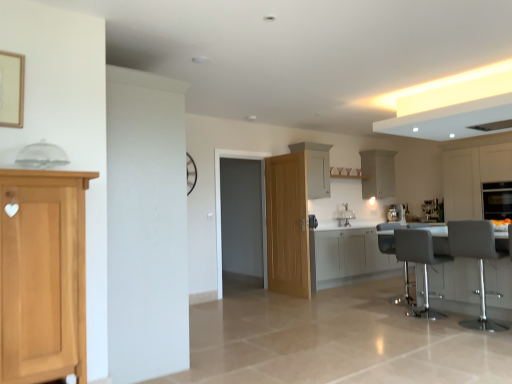
Where is `matte black oven at right`? The width and height of the screenshot is (512, 384). matte black oven at right is located at coordinates (497, 200).

Describe the element at coordinates (497, 200) in the screenshot. Image resolution: width=512 pixels, height=384 pixels. I see `matte black oven at right` at that location.

Where is `light brown wood cabinet at left, the fifth cabinetry when ordered from right to left`? This screenshot has height=384, width=512. light brown wood cabinet at left, the fifth cabinetry when ordered from right to left is located at coordinates point(42,276).

What are the coordinates of `white glossy cabinets at center, the 3th cabinetry from the right` in the screenshot? It's located at (347, 257).

What do you see at coordinates (453, 120) in the screenshot? I see `white glossy exhaust hood at upper right` at bounding box center [453, 120].

What is the approximate width of transparent glass door at center?

transparent glass door at center is 8.96 inches in width.

Locate an element on the screen. matte black oven at right is located at coordinates (497, 200).

Can you confirm if matte black oven at right is positioned to the right of white matte cabinet at right, which is the third cabinetry in back-to-front order?

Yes.

Is matte black oven at right facing away from white matte cabinet at right, which ranks as the 3th cabinetry in front-to-back order?

That's right, matte black oven at right is facing away from white matte cabinet at right, which ranks as the 3th cabinetry in front-to-back order.

From the picture: From a real-world perspective, between matte black oven at right and white matte cabinet at right, which ranks as the 3th cabinetry in front-to-back order, who is vertically higher?

white matte cabinet at right, which ranks as the 3th cabinetry in front-to-back order, is physically above.

What's the angular difference between matte black oven at right and white matte cabinet at right, which ranks as the 3th cabinetry in front-to-back order,'s facing directions?

There is a 1.62-degree angle between the facing directions of matte black oven at right and white matte cabinet at right, which ranks as the 3th cabinetry in front-to-back order.

Considering the sizes of white glossy cabinets at center, the 3th cabinetry from the right, and gray fabric swivel chair at lower right in the image, is white glossy cabinets at center, the 3th cabinetry from the right, bigger or smaller than gray fabric swivel chair at lower right?

Clearly, white glossy cabinets at center, the 3th cabinetry from the right, is larger in size than gray fabric swivel chair at lower right.

Which of these two, white glossy cabinets at center, the 3th cabinetry from the right, or gray fabric swivel chair at lower right, is wider?

Wider between the two is white glossy cabinets at center, the 3th cabinetry from the right.

Considering the sizes of objects white glossy cabinets at center, the 3th cabinetry from the right, and gray fabric swivel chair at lower right in the image provided, who is taller, white glossy cabinets at center, the 3th cabinetry from the right, or gray fabric swivel chair at lower right?

gray fabric swivel chair at lower right.

How different are the orientations of white glossy cabinets at center, which appears as the 3th cabinetry when viewed from the left, and gray fabric swivel chair at lower right in degrees?

white glossy cabinets at center, which appears as the 3th cabinetry when viewed from the left, and gray fabric swivel chair at lower right are facing 1.76 degrees away from each other.

Is white matte cabinet at center, which appears as the fourth cabinetry when viewed from the front, facing away from white leather bar stool at right, arranged as the 2th chair when viewed from the front?

No, white matte cabinet at center, which appears as the fourth cabinetry when viewed from the front,'s orientation is not away from white leather bar stool at right, arranged as the 2th chair when viewed from the front.

Is white matte cabinet at center, which is counted as the 4th cabinetry, starting from the right, in front of or behind white leather bar stool at right, acting as the first chair starting from the back, in the image?

Result: white matte cabinet at center, which is counted as the 4th cabinetry, starting from the right, is positioned farther from the viewer than white leather bar stool at right, acting as the first chair starting from the back.

Is white matte cabinet at center, the 2th cabinetry in the back-to-front sequence, surrounding white leather bar stool at right, arranged as the 2th chair when viewed from the front?

No, white leather bar stool at right, arranged as the 2th chair when viewed from the front, is not inside white matte cabinet at center, the 2th cabinetry in the back-to-front sequence.

Considering the sizes of objects white matte cabinet at center, acting as the second cabinetry starting from the left, and white leather bar stool at right, acting as the first chair starting from the back, in the image provided, who is smaller, white matte cabinet at center, acting as the second cabinetry starting from the left, or white leather bar stool at right, acting as the first chair starting from the back,?

With smaller size is white matte cabinet at center, acting as the second cabinetry starting from the left.

From the image's perspective, is white matte cabinet at right, acting as the 1th cabinetry starting from the right, positioned above or below white glossy sink at center?

white matte cabinet at right, acting as the 1th cabinetry starting from the right, is situated higher than white glossy sink at center in the image.

Could you tell me if white matte cabinet at right, placed as the fifth cabinetry when sorted from left to right, is turned towards white glossy sink at center?

No.

Is white matte cabinet at right, acting as the 1th cabinetry starting from the right, not close to white glossy sink at center?

That's right, there is a large distance between white matte cabinet at right, acting as the 1th cabinetry starting from the right, and white glossy sink at center.

Considering the relative sizes of white matte cabinet at right, acting as the 1th cabinetry starting from the right, and white glossy sink at center in the image provided, is white matte cabinet at right, acting as the 1th cabinetry starting from the right, shorter than white glossy sink at center?

In fact, white matte cabinet at right, acting as the 1th cabinetry starting from the right, may be taller than white glossy sink at center.

Does metallic gray table at lower right turn towards white glossy cabinets at center, the 3th cabinetry from the right?

No, metallic gray table at lower right is not aimed at white glossy cabinets at center, the 3th cabinetry from the right.

How many degrees apart are the facing directions of metallic gray table at lower right and white glossy cabinets at center, which is the 2th cabinetry in front-to-back order?

90.5 degrees separate the facing orientations of metallic gray table at lower right and white glossy cabinets at center, which is the 2th cabinetry in front-to-back order.

Which of these two, metallic gray table at lower right or white glossy cabinets at center, which is the 2th cabinetry in front-to-back order, is smaller?

With smaller size is white glossy cabinets at center, which is the 2th cabinetry in front-to-back order.

Measure the distance from natural wood door at center to matte black oven at right.

natural wood door at center is 3.37 meters away from matte black oven at right.

Is natural wood door at center far from matte black oven at right?

That's right, there is a large distance between natural wood door at center and matte black oven at right.

Does point (300, 177) come closer to viewer compared to point (494, 189)?

Yes, point (300, 177) is closer to viewer.

Where is `door in front of the matte black oven at right`? The image size is (512, 384). door in front of the matte black oven at right is located at coordinates (287, 225).

Considering the sizes of natural wood door at center and gray fabric chair at right, the second chair positioned from the back, in the image, is natural wood door at center bigger or smaller than gray fabric chair at right, the second chair positioned from the back,?

natural wood door at center is smaller than gray fabric chair at right, the second chair positioned from the back.

From a real-world perspective, is natural wood door at center located higher than gray fabric chair at right, the second chair positioned from the back?

Yes, from a real-world perspective, natural wood door at center is over gray fabric chair at right, the second chair positioned from the back

In the scene shown: Is gray fabric chair at right, the second chair positioned from the back, at the back of natural wood door at center?

No, natural wood door at center is not facing the opposite direction of gray fabric chair at right, the second chair positioned from the back.

From the image's perspective, is natural wood door at center located above or below gray fabric chair at right, the second chair positioned from the back?

From the image's perspective, natural wood door at center appears above gray fabric chair at right, the second chair positioned from the back.

Locate an element on the screen. The image size is (512, 384). the 1st cabinetry in front of the matte black oven at right, starting your count from the anchor is located at coordinates (472, 177).

At what (x,y) coordinates should I click in order to perform the action: click on cabinetry located below the gray fabric swivel chair at lower right (from the image's perspective). Please return your answer as a coordinate pair (x, y). The height and width of the screenshot is (384, 512). Looking at the image, I should click on (347, 257).

When comparing their distances from white glossy sink at center, does white matte cabinet at right, which is the third cabinetry in back-to-front order, or white glossy exhaust hood at upper right seem closer?

Based on the image, white glossy exhaust hood at upper right appears to be nearer to white glossy sink at center.

Estimate the real-world distances between objects in this image. Which object is further from white leather bar stool at right, arranged as the 2th chair when viewed from the front, natural wood door at center or white glossy sink at center?

Among the two, white glossy sink at center is located further to white leather bar stool at right, arranged as the 2th chair when viewed from the front.

Estimate the real-world distances between objects in this image. Which object is closer to matte black oven at right, transparent glass door at center or metallic gray table at lower right?

metallic gray table at lower right lies closer to matte black oven at right than the other object.

Based on their spatial positions, is matte black oven at right or satin silver coffee machine at right, positioned as the 2th coffee machine in left-to-right order, further from transparent glass door at center?

satin silver coffee machine at right, positioned as the 2th coffee machine in left-to-right order.

Looking at the image, which one is located further to white matte cabinet at right, acting as the 1th cabinetry starting from the right, transparent glass door at center or white glossy cabinets at center, which is the 2th cabinetry in front-to-back order?

The object further to white matte cabinet at right, acting as the 1th cabinetry starting from the right, is transparent glass door at center.

When comparing their distances from gray fabric swivel chair at lower right, does white matte cabinet at right, which is the third cabinetry in back-to-front order, or white glossy exhaust hood at upper right seem further?

white matte cabinet at right, which is the third cabinetry in back-to-front order, is positioned further to the anchor gray fabric swivel chair at lower right.

When comparing their distances from white matte cabinet at upper right, the first cabinetry positioned from the back, does satin silver coffee machine at right, positioned as the 2th coffee machine in left-to-right order, or gray fabric chair at right, the first chair in the front-to-back sequence, seem further?

gray fabric chair at right, the first chair in the front-to-back sequence, is further to white matte cabinet at upper right, the first cabinetry positioned from the back.

Looking at the image, which one is located further to light brown wood cabinet at left, which appears as the 5th cabinetry when viewed from the back, white matte cabinet at right, acting as the 1th cabinetry starting from the right, or gray fabric swivel chair at lower right?

Among the two, white matte cabinet at right, acting as the 1th cabinetry starting from the right, is located further to light brown wood cabinet at left, which appears as the 5th cabinetry when viewed from the back.

The height and width of the screenshot is (384, 512). Find the location of `table between gray fabric chair at right, the second chair positioned from the back, and matte black oven at right in the front-back direction`. table between gray fabric chair at right, the second chair positioned from the back, and matte black oven at right in the front-back direction is located at coordinates (455, 286).

The height and width of the screenshot is (384, 512). I want to click on door located between gray fabric chair at right, the first chair in the front-to-back sequence, and satin silver coffee machine at center, which appears as the second coffee machine when viewed from the right, in the depth direction, so click(287, 225).

Locate an element on the screen. The height and width of the screenshot is (384, 512). chair between metallic gray table at lower right and satin silver coffee machine at center, which appears as the second coffee machine when viewed from the right, in the front-back direction is located at coordinates (419, 262).

Find the location of a particular element. This screenshot has height=384, width=512. sink positioned between white leather bar stool at right, acting as the first chair starting from the back, and satin silver coffee machine at center, which appears as the second coffee machine when viewed from the right, from near to far is located at coordinates (345, 216).